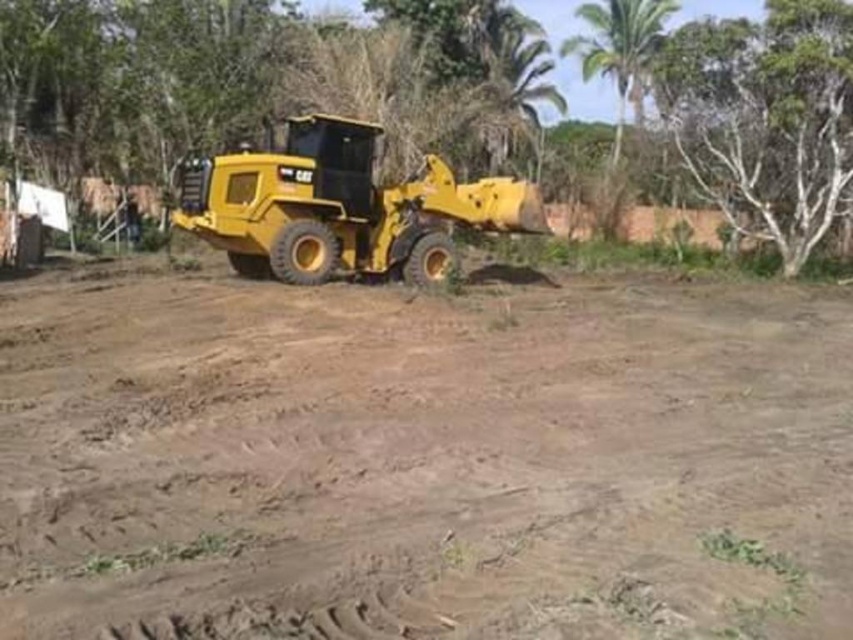
Question: Which object appears farthest from the camera in this image?

Choices:
 (A) yellow matte tractor at center
 (B) brown sandy dirt at center

Answer: (A)

Question: Is brown sandy dirt at center thinner than green leafy tree at upper center?

Choices:
 (A) no
 (B) yes

Answer: (B)

Question: Does brown sandy dirt at center have a smaller size compared to green leafy tree at upper center?

Choices:
 (A) no
 (B) yes

Answer: (B)

Question: Is brown sandy dirt at center wider than white smooth tree at upper right?

Choices:
 (A) yes
 (B) no

Answer: (A)

Question: Which object appears closest to the camera in this image?

Choices:
 (A) brown sandy dirt at center
 (B) yellow matte tractor at center
 (C) green leafy tree at upper center
 (D) white smooth tree at upper right

Answer: (A)

Question: Which object is the farthest from the green leafy tree at upper center?

Choices:
 (A) yellow matte tractor at center
 (B) white smooth tree at upper right
 (C) brown sandy dirt at center

Answer: (A)